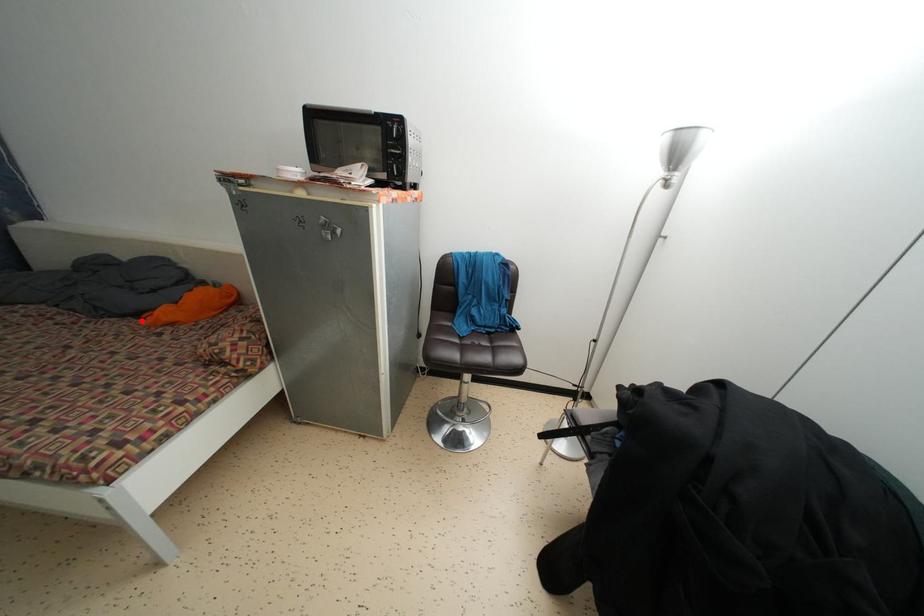
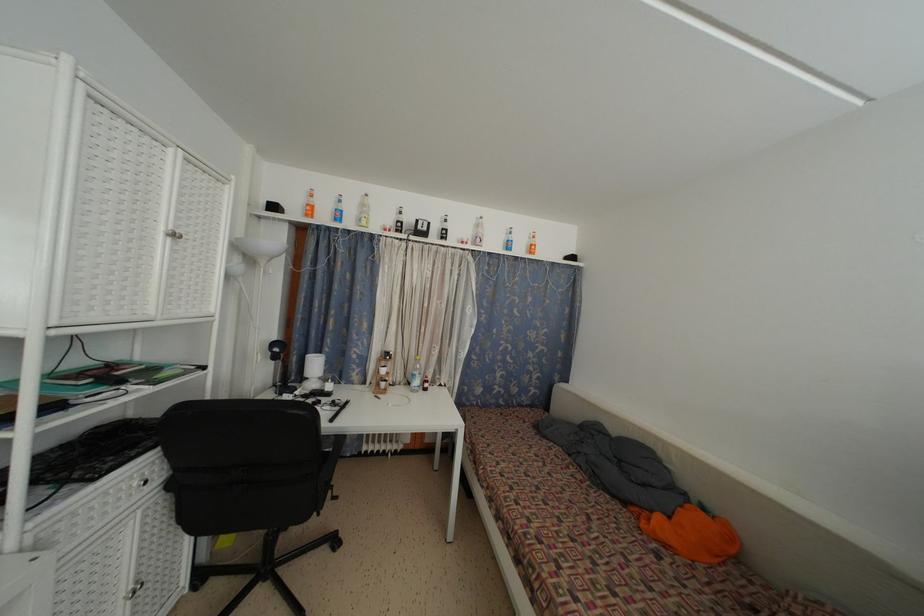
Where in the second image is the point corresponding to the highlighted location from the first image?

(629, 509)